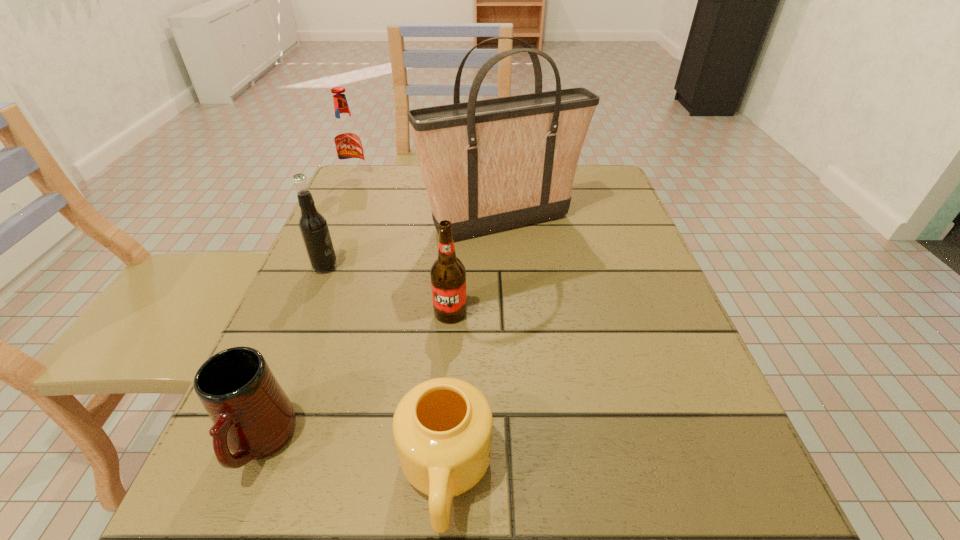
Find the location of a particular element. free space located 0.110m on the right of the rightmost root beer is located at coordinates (528, 313).

Find the location of a particular element. The width and height of the screenshot is (960, 540). free point located 0.050m on the side of the left mug with the handle is located at coordinates (224, 531).

Where is `shopping bag situated at the far edge`? This screenshot has height=540, width=960. shopping bag situated at the far edge is located at coordinates (491, 165).

The image size is (960, 540). I want to click on root beer located in the far edge section of the desktop, so pyautogui.click(x=347, y=137).

The height and width of the screenshot is (540, 960). In order to click on object that is at the near edge in this screenshot , I will do `click(253, 418)`.

What are the coordinates of `mug at the left edge` in the screenshot? It's located at (253, 418).

At what (x,y) coordinates should I click in order to perform the action: click on object that is at the right edge. Please return your answer as a coordinate pair (x, y). Looking at the image, I should click on (491, 165).

Identify the location of object that is at the far left corner. (347, 137).

Identify the location of object located in the near left corner section of the desktop. (253, 418).

Where is `object located in the far right corner section of the desktop`? The height and width of the screenshot is (540, 960). object located in the far right corner section of the desktop is located at coordinates (491, 165).